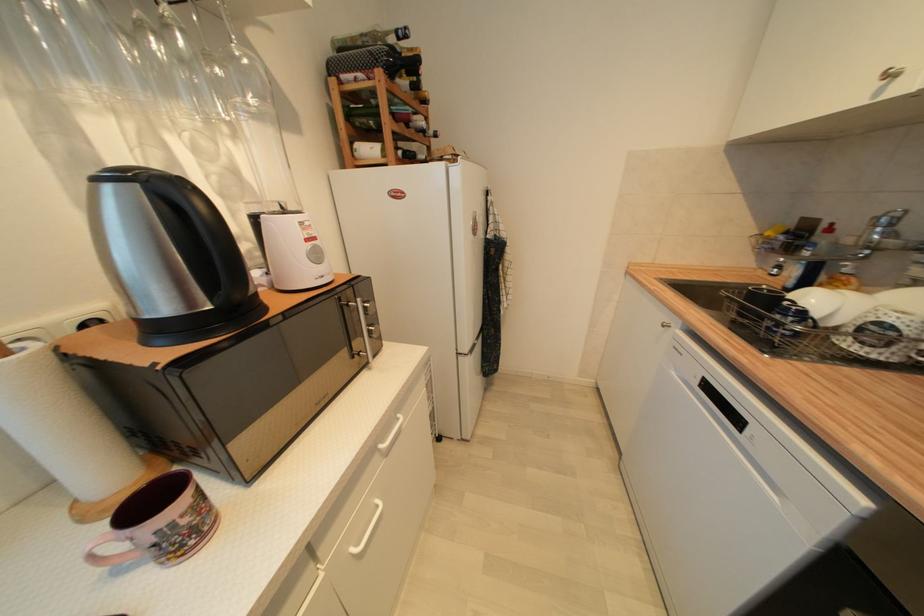
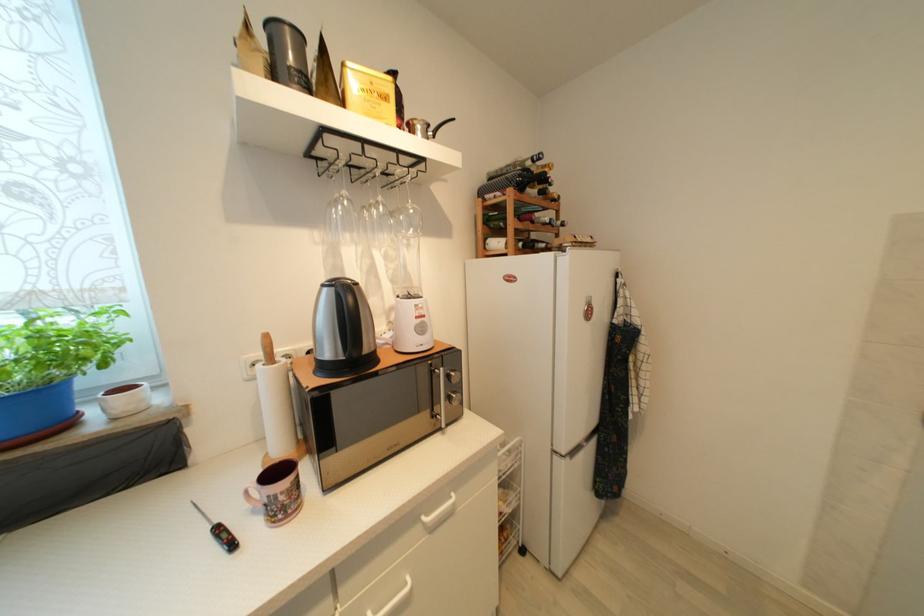
In the second image, find the point that corresponds to [311,241] in the first image.

(421, 320)